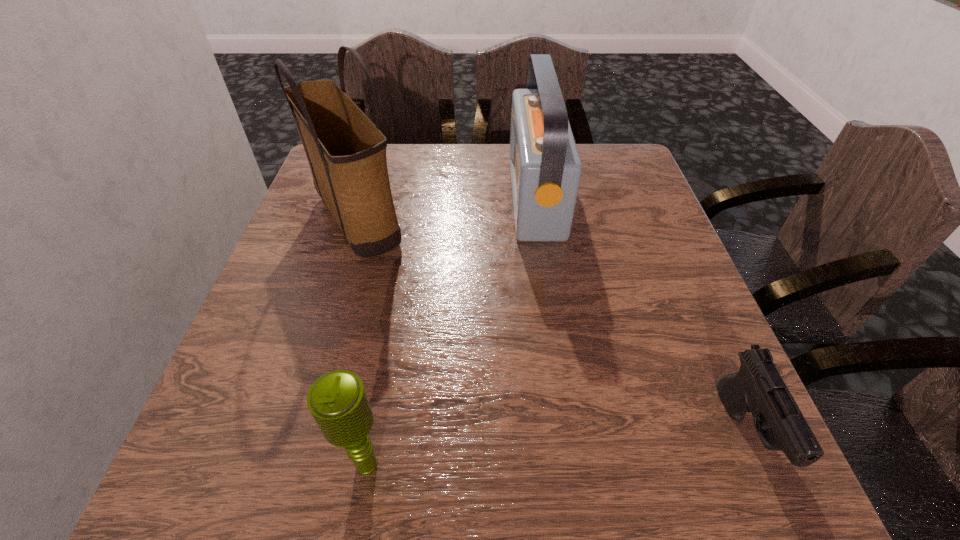
Where is `vacant space at the near edge of the desktop`? The image size is (960, 540). vacant space at the near edge of the desktop is located at coordinates [x=323, y=490].

At what (x,y) coordinates should I click in order to perform the action: click on free region at the left edge of the desktop. Please return your answer as a coordinate pair (x, y). The image size is (960, 540). Looking at the image, I should click on (289, 330).

Where is `free space at the right edge`? The image size is (960, 540). free space at the right edge is located at coordinates (654, 330).

Find the location of a particular element. This screenshot has height=540, width=960. vacant space at the near left corner of the desktop is located at coordinates (200, 462).

In the image, there is a desktop. Identify the location of vacant area at the far right corner. Image resolution: width=960 pixels, height=540 pixels. (612, 144).

You are a GUI agent. You are given a task and a screenshot of the screen. Output one action in this format:
    pyautogui.click(x=<x>, y=<y>)
    Task: Click on the empty location between the shortest object and the tallest object
    The image size is (960, 540).
    Given the screenshot: What is the action you would take?
    pyautogui.click(x=551, y=325)

The image size is (960, 540). Identify the location of empty space between the third shortest object and the tote bag. (446, 207).

Locate an element on the screen. The height and width of the screenshot is (540, 960). vacant region between the shortest object and the radio receiver is located at coordinates (640, 314).

At what (x,y) coordinates should I click in order to perform the action: click on unoccupied position between the shortest object and the third tallest object. Please return your answer as a coordinate pair (x, y). Image resolution: width=960 pixels, height=540 pixels. Looking at the image, I should click on (556, 448).

I want to click on vacant area that lies between the rightmost object and the third object from left to right, so tap(640, 314).